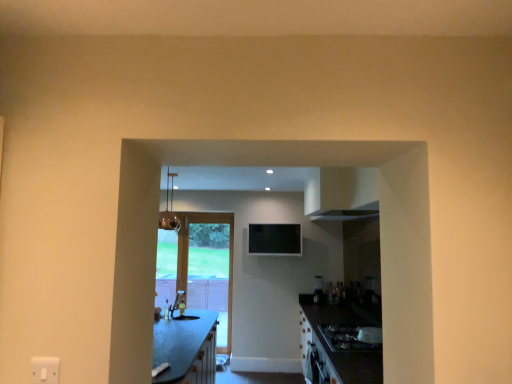
Question: Does matte glass light fixture at upper center come in front of satin black blender at center?

Choices:
 (A) no
 (B) yes

Answer: (B)

Question: Is matte glass light fixture at upper center smaller than satin black blender at center?

Choices:
 (A) yes
 (B) no

Answer: (B)

Question: Is matte glass light fixture at upper center looking in the opposite direction of satin black blender at center?

Choices:
 (A) no
 (B) yes

Answer: (A)

Question: Does matte glass light fixture at upper center lie behind satin black blender at center?

Choices:
 (A) no
 (B) yes

Answer: (A)

Question: Could you tell me if matte glass light fixture at upper center is facing satin black blender at center?

Choices:
 (A) yes
 (B) no

Answer: (B)

Question: Is matte glass light fixture at upper center in contact with satin black blender at center?

Choices:
 (A) yes
 (B) no

Answer: (B)

Question: From the image's perspective, is satin black blender at center over wooden glass door at center?

Choices:
 (A) yes
 (B) no

Answer: (A)

Question: Is wooden glass door at center completely or partially inside satin black blender at center?

Choices:
 (A) no
 (B) yes

Answer: (A)

Question: Is satin black blender at center far away from wooden glass door at center?

Choices:
 (A) yes
 (B) no

Answer: (A)

Question: Is satin black blender at center facing towards wooden glass door at center?

Choices:
 (A) yes
 (B) no

Answer: (B)

Question: Considering the relative sizes of satin black blender at center and wooden glass door at center in the image provided, is satin black blender at center taller than wooden glass door at center?

Choices:
 (A) no
 (B) yes

Answer: (A)

Question: From a real-world perspective, is satin black blender at center under wooden glass door at center?

Choices:
 (A) no
 (B) yes

Answer: (A)

Question: Is wooden glass door at center positioned before black glossy gas stove at lower right?

Choices:
 (A) yes
 (B) no

Answer: (B)